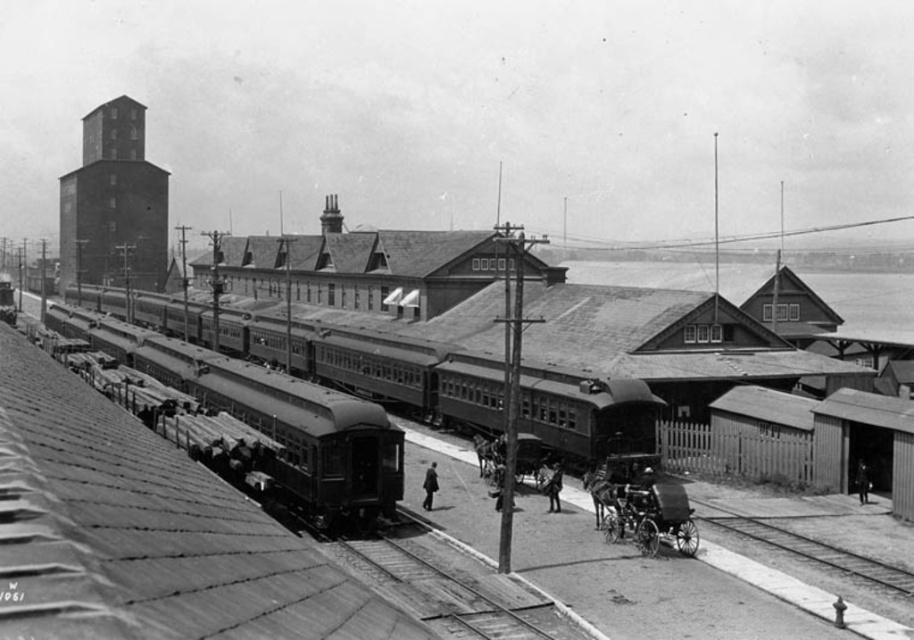
Who is positioned more to the right, smooth dark metal train at center or dark gray suit at center?

Positioned to the right is dark gray suit at center.

Who is taller, smooth dark metal train at center or dark gray suit at center?

With more height is smooth dark metal train at center.

Find the location of a particular element. The width and height of the screenshot is (914, 640). smooth dark metal train at center is located at coordinates (270, 417).

Who is positioned more to the left, smooth metal train at center or smooth wood track at lower right?

From the viewer's perspective, smooth metal train at center appears more on the left side.

Between smooth metal train at center and smooth wood track at lower right, which one is positioned lower?

smooth wood track at lower right

Between point (203, 333) and point (711, 522), which one is positioned in front?

Positioned in front is point (711, 522).

Locate an element on the screen. This screenshot has height=640, width=914. smooth metal train at center is located at coordinates (402, 372).

Is smooth dark metal train at center shorter than smooth leather coat at center?

In fact, smooth dark metal train at center may be taller than smooth leather coat at center.

Does smooth dark metal train at center lie behind smooth leather coat at center?

No, smooth dark metal train at center is in front of smooth leather coat at center.

Is point (187, 349) positioned in front of point (551, 490)?

No, it is behind (551, 490).

Where is `smooth dark metal train at center`? The width and height of the screenshot is (914, 640). smooth dark metal train at center is located at coordinates (270, 417).